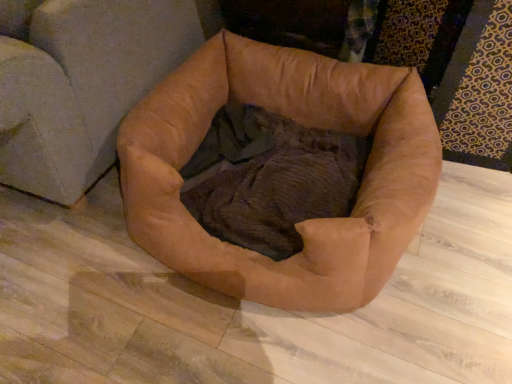
Where is `brown leather swivel chair at lower center`? brown leather swivel chair at lower center is located at coordinates (85, 84).

What do you see at coordinates (85, 84) in the screenshot? The height and width of the screenshot is (384, 512). I see `brown leather swivel chair at lower center` at bounding box center [85, 84].

Locate an element on the screen. brown leather swivel chair at lower center is located at coordinates (85, 84).